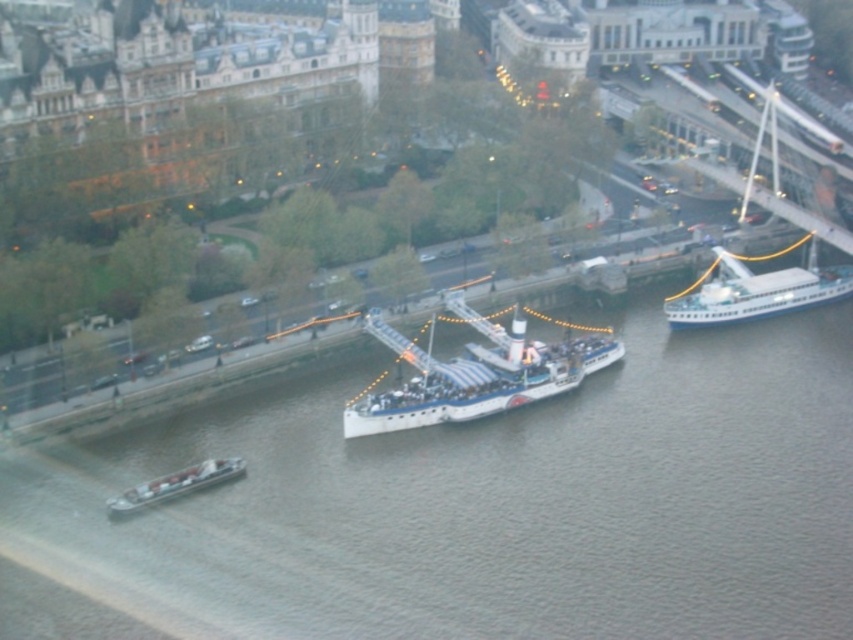
You are standing on the riverside walkway and want to take a photo of both the white glossy boat at center and the white plastic boat at lower left. Which boat should you position closer to the camera to include both in the frame?

You should position the white glossy boat at center closer to the camera since the white plastic boat at lower left is behind it, ensuring both are visible in the frame.

You are a drone operator trying to capture a photo of the gray matte water at center. According to the coordinates provided, where should you position the drone to get the best shot?

The gray matte water at center is located at point [473,506], so position the drone at those coordinates for the best shot.